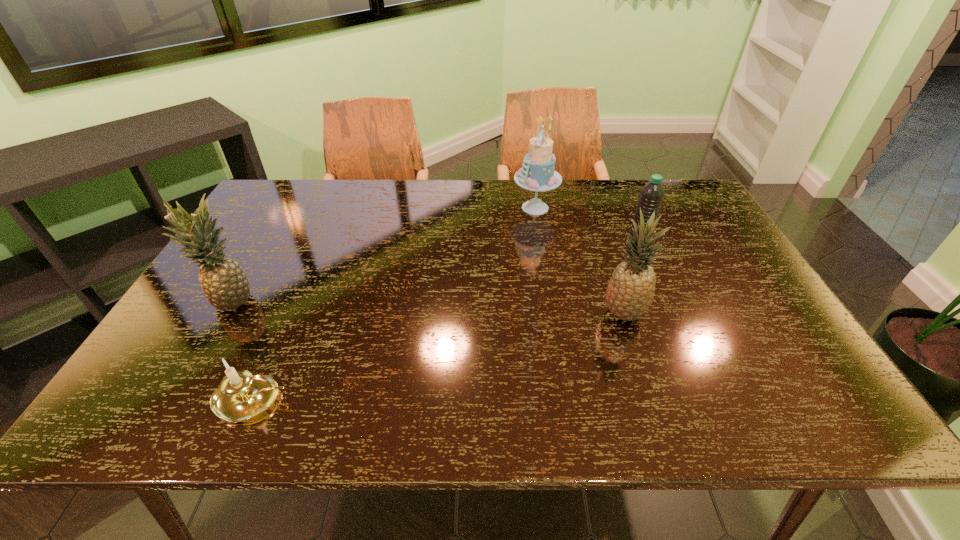
Where is `the third object from right to left`? the third object from right to left is located at coordinates (537, 174).

Where is `the farthest object`? the farthest object is located at coordinates (537, 174).

Locate an element on the screen. the left pineapple is located at coordinates [x=225, y=285].

The image size is (960, 540). In order to click on the right pineapple in this screenshot , I will do `click(630, 291)`.

This screenshot has width=960, height=540. I want to click on water bottle, so click(651, 196).

Locate an element on the screen. the rightmost object is located at coordinates (651, 196).

At what (x,y) coordinates should I click in order to perform the action: click on the nearest object. Please return your answer as a coordinate pair (x, y). The image size is (960, 540). Looking at the image, I should click on (241, 396).

At what (x,y) coordinates should I click in order to perform the action: click on candle holder. Please return your answer as a coordinate pair (x, y). Looking at the image, I should click on (241, 396).

Find the location of a particular element. Image resolution: width=960 pixels, height=540 pixels. vacant space located with a ladder on the side of the farthest object is located at coordinates (467, 208).

Where is `vacant space located 0.390m with a ladder on the side of the farthest object`? Image resolution: width=960 pixels, height=540 pixels. vacant space located 0.390m with a ladder on the side of the farthest object is located at coordinates (393, 208).